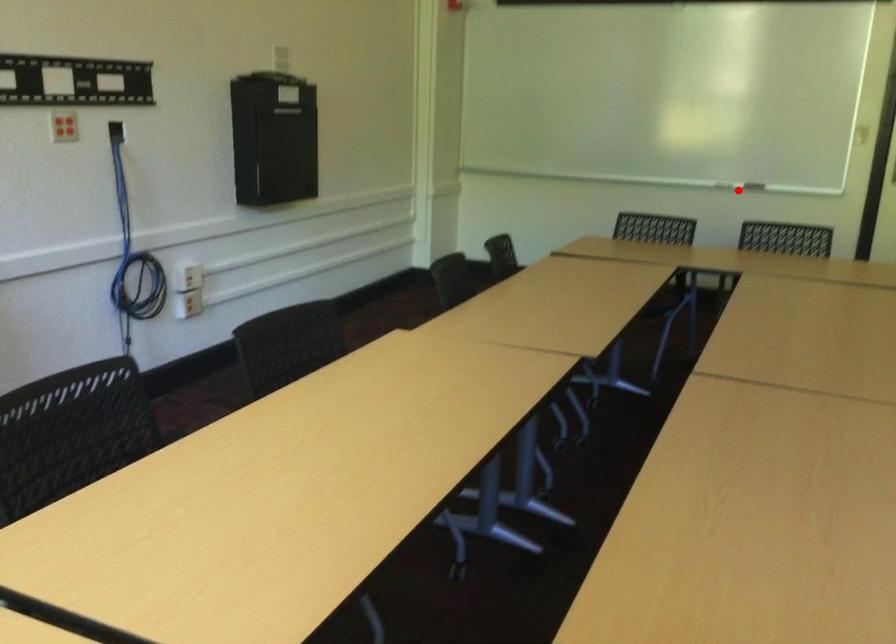
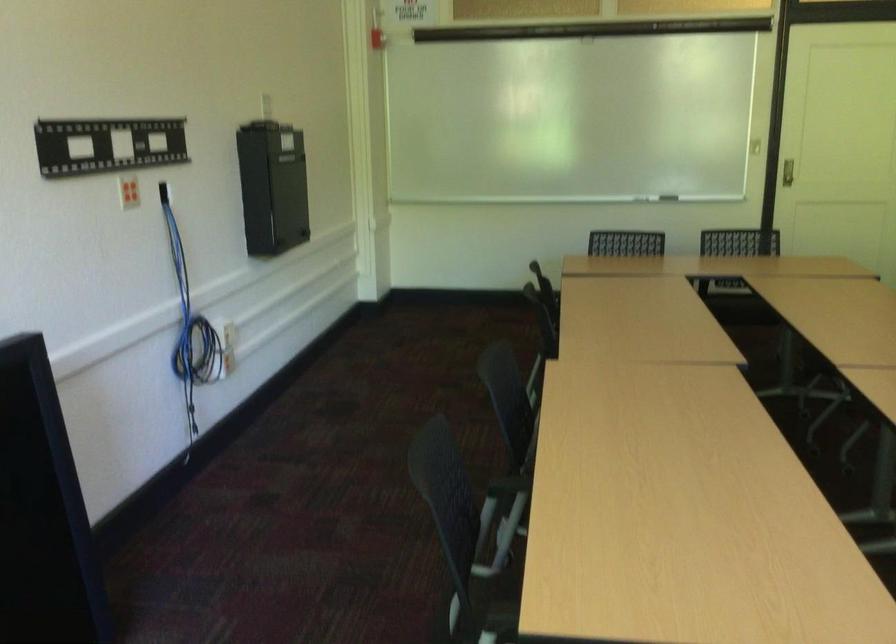
Question: I am providing you with two images of the same scene from different viewpoints. In image1, a red point is highlighted. Considering the same 3D point in image2, which of the following is correct?

Choices:
 (A) It is closer
 (B) It is farther

Answer: (B)